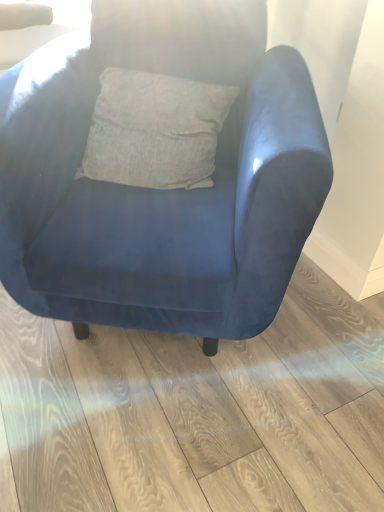
Where is `free spot in front of velvet blue armchair at center`? free spot in front of velvet blue armchair at center is located at coordinates (163, 436).